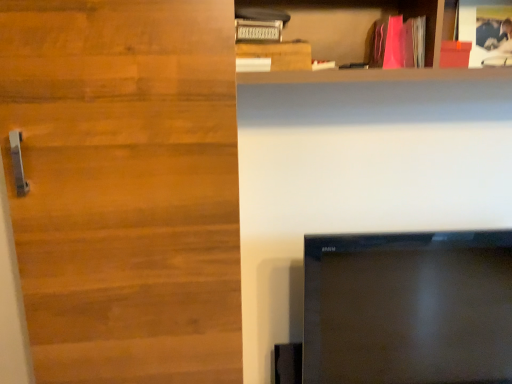
Question: Should I look upward or downward to see wooden door at left?

Choices:
 (A) down
 (B) up

Answer: (A)

Question: Is wooden door at left to the left of wooden plank at upper center from the viewer's perspective?

Choices:
 (A) yes
 (B) no

Answer: (A)

Question: Does wooden door at left have a greater width compared to wooden plank at upper center?

Choices:
 (A) yes
 (B) no

Answer: (A)

Question: Is the position of wooden door at left more distant than that of wooden plank at upper center?

Choices:
 (A) yes
 (B) no

Answer: (B)

Question: Is wooden door at left not near wooden plank at upper center?

Choices:
 (A) no
 (B) yes

Answer: (A)

Question: Is wooden door at left bigger than wooden plank at upper center?

Choices:
 (A) yes
 (B) no

Answer: (A)

Question: Is wooden door at left positioned beyond the bounds of wooden plank at upper center?

Choices:
 (A) yes
 (B) no

Answer: (A)

Question: From a real-world perspective, is matte wooden shelf at upper right located higher than pink matte book at upper right?

Choices:
 (A) no
 (B) yes

Answer: (A)

Question: Are matte wooden shelf at upper right and pink matte book at upper right located far from each other?

Choices:
 (A) yes
 (B) no

Answer: (B)

Question: Is matte wooden shelf at upper right smaller than pink matte book at upper right?

Choices:
 (A) no
 (B) yes

Answer: (A)

Question: Considering the relative positions of matte wooden shelf at upper right and pink matte book at upper right in the image provided, is matte wooden shelf at upper right to the left of pink matte book at upper right from the viewer's perspective?

Choices:
 (A) yes
 (B) no

Answer: (A)

Question: Is matte wooden shelf at upper right looking in the opposite direction of pink matte book at upper right?

Choices:
 (A) yes
 (B) no

Answer: (A)

Question: Does matte wooden shelf at upper right have a larger size compared to pink matte book at upper right?

Choices:
 (A) no
 (B) yes

Answer: (B)

Question: Is the surface of black glossy tv at lower right in direct contact with wooden door at left?

Choices:
 (A) no
 (B) yes

Answer: (A)